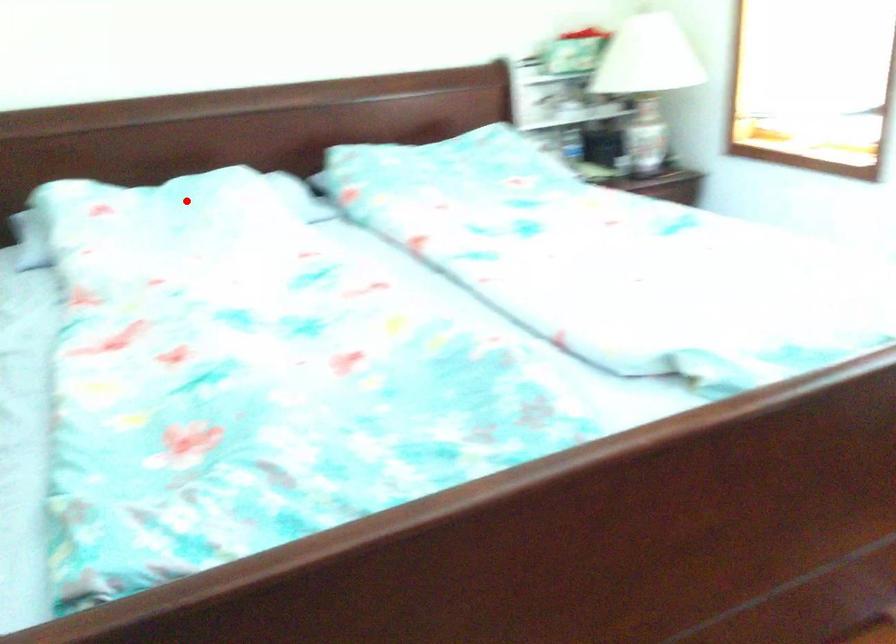
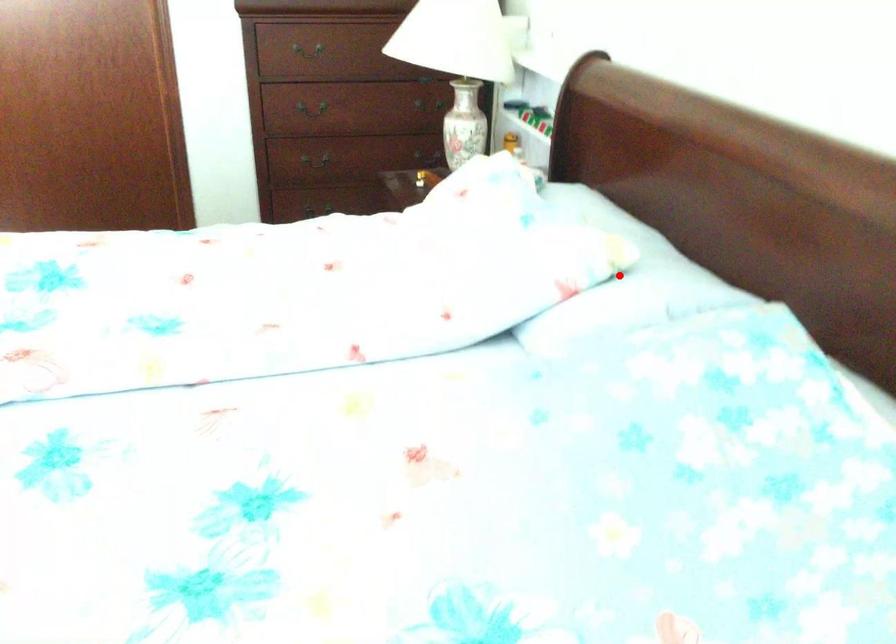
I am providing you with two images of the same scene from different viewpoints. A red point is marked on the first image and another point is marked on the second image. Does the point marked in image1 correspond to the same location as the one in image2?

Yes